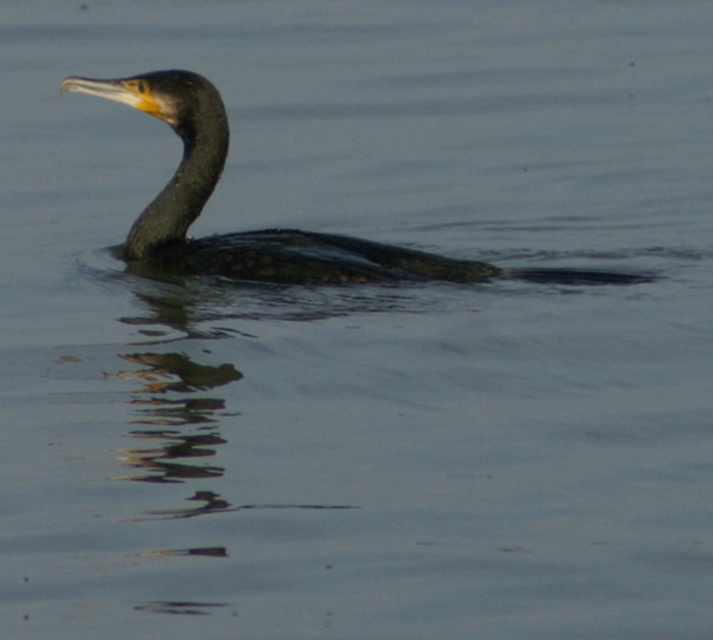
From the picture: You are observing the cormorant bird in the water. There are two points marked in the scene. Which point is closer to you, point (366, 246) or point (175, 204)?

Point (366, 246) is closer to the viewer than point (175, 204).

You are a photographer aiming to capture the reflection of the shiny black duck at center and the dark gray matte neck at center in the water. Since the water surface is calm, which object will have a clearer reflection?

The shiny black duck at center will have a clearer reflection because it is located below the dark gray matte neck at center, meaning it is closer to the water surface where reflections are clearer.